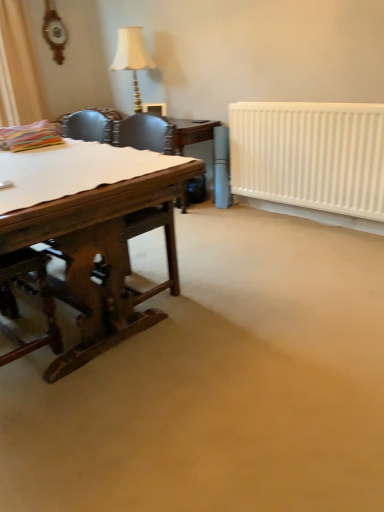
Question: Considering the relative sizes of white paper at left and matte gold lamp at upper center in the image provided, is white paper at left thinner than matte gold lamp at upper center?

Choices:
 (A) yes
 (B) no

Answer: (B)

Question: Can you confirm if white paper at left is positioned to the left of matte gold lamp at upper center?

Choices:
 (A) yes
 (B) no

Answer: (A)

Question: From the image's perspective, does white paper at left appear lower than matte gold lamp at upper center?

Choices:
 (A) yes
 (B) no

Answer: (A)

Question: Is the surface of white paper at left in direct contact with matte gold lamp at upper center?

Choices:
 (A) yes
 (B) no

Answer: (B)

Question: Is white paper at left looking in the opposite direction of matte gold lamp at upper center?

Choices:
 (A) no
 (B) yes

Answer: (A)

Question: Considering the positions of white matte radiator at right and matte gold lamp at upper center in the image, is white matte radiator at right bigger or smaller than matte gold lamp at upper center?

Choices:
 (A) big
 (B) small

Answer: (A)

Question: From the image's perspective, is white matte radiator at right above or below matte gold lamp at upper center?

Choices:
 (A) above
 (B) below

Answer: (B)

Question: Visually, is white matte radiator at right positioned to the left or to the right of matte gold lamp at upper center?

Choices:
 (A) left
 (B) right

Answer: (B)

Question: From a real-world perspective, relative to matte gold lamp at upper center, is white matte radiator at right vertically above or below?

Choices:
 (A) below
 (B) above

Answer: (A)

Question: Looking at the image, does white matte radiator at right seem bigger or smaller compared to brown wooden desk at left?

Choices:
 (A) big
 (B) small

Answer: (B)

Question: From their relative heights in the image, would you say white matte radiator at right is taller or shorter than brown wooden desk at left?

Choices:
 (A) short
 (B) tall

Answer: (A)

Question: From the image's perspective, relative to brown wooden desk at left, is white matte radiator at right above or below?

Choices:
 (A) below
 (B) above

Answer: (B)

Question: Visually, is white matte radiator at right positioned to the left or to the right of brown wooden desk at left?

Choices:
 (A) left
 (B) right

Answer: (B)

Question: Considering the positions of point (134, 164) and point (382, 187), is point (134, 164) closer or farther from the camera than point (382, 187)?

Choices:
 (A) farther
 (B) closer

Answer: (B)

Question: Is white paper at left inside or outside of white matte radiator at right?

Choices:
 (A) inside
 (B) outside

Answer: (B)